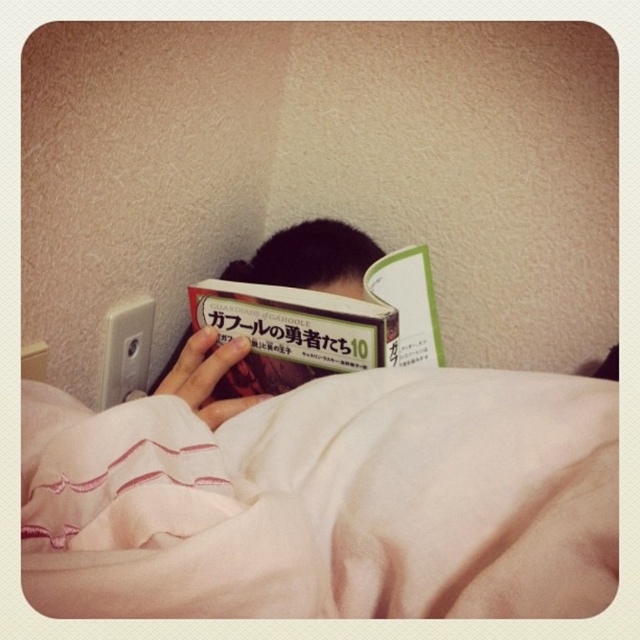
Question: Among these objects, which one is nearest to the camera?

Choices:
 (A) pink soft fabric blanket at lower center
 (B) matte black book at center
 (C) hardcover book at center

Answer: (A)

Question: Estimate the real-world distances between objects in this image. Which object is closer to the hardcover book at center?

Choices:
 (A) pink soft fabric blanket at lower center
 (B) matte black book at center

Answer: (B)

Question: Is hardcover book at center below matte black book at center?

Choices:
 (A) no
 (B) yes

Answer: (B)

Question: Where is pink soft fabric blanket at lower center located in relation to matte black book at center in the image?

Choices:
 (A) above
 (B) below

Answer: (B)

Question: Which object appears closest to the camera in this image?

Choices:
 (A) matte black book at center
 (B) pink soft fabric blanket at lower center
 (C) hardcover book at center

Answer: (B)

Question: Considering the relative positions of pink soft fabric blanket at lower center and hardcover book at center in the image provided, where is pink soft fabric blanket at lower center located with respect to hardcover book at center?

Choices:
 (A) right
 (B) left

Answer: (A)